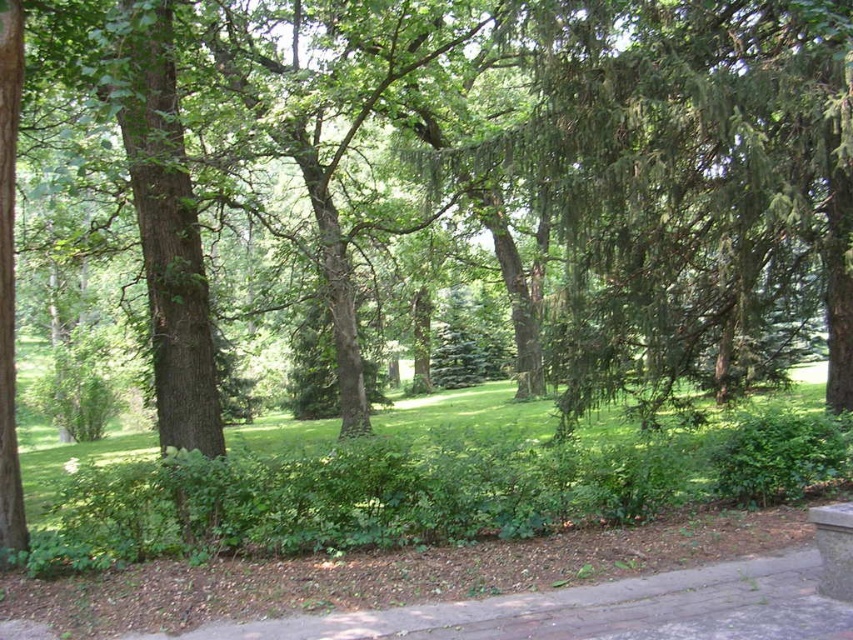
Question: Which of the following is the farthest from the observer?

Choices:
 (A) (368, 620)
 (B) (228, 474)

Answer: (B)

Question: Observing the image, what is the correct spatial positioning of green leafy grass at center in reference to brown brick pavement at lower center?

Choices:
 (A) below
 (B) above

Answer: (A)

Question: Which point appears farthest from the camera in this image?

Choices:
 (A) (786, 566)
 (B) (669, 440)

Answer: (B)

Question: Is green leafy grass at center thinner than brown brick pavement at lower center?

Choices:
 (A) yes
 (B) no

Answer: (B)

Question: Among these objects, which one is nearest to the camera?

Choices:
 (A) brown brick pavement at lower center
 (B) green leafy grass at center

Answer: (A)

Question: Does green leafy grass at center have a smaller size compared to brown brick pavement at lower center?

Choices:
 (A) no
 (B) yes

Answer: (A)